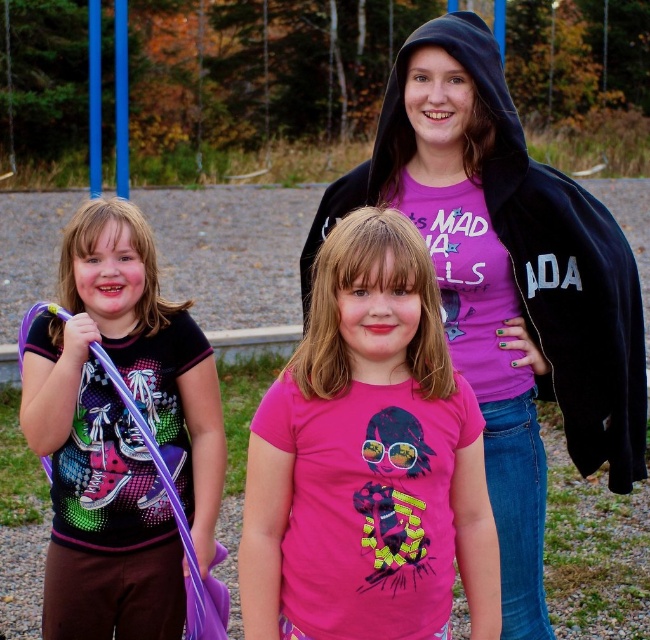
Question: Does matte black hoodie at upper center appear on the right side of matte purple wand at left?

Choices:
 (A) no
 (B) yes

Answer: (B)

Question: Where is pink matte t-shirt at center located in relation to matte purple wand at left in the image?

Choices:
 (A) right
 (B) left

Answer: (A)

Question: Does matte black hoodie at upper center have a lesser width compared to pink matte t-shirt at center?

Choices:
 (A) no
 (B) yes

Answer: (A)

Question: Which of the following is the farthest from the observer?

Choices:
 (A) pink matte t-shirt at center
 (B) matte purple wand at left
 (C) matte black hoodie at upper center

Answer: (C)

Question: Which of the following is the farthest from the observer?

Choices:
 (A) click(378, 232)
 (B) click(517, 490)
 (C) click(118, 481)

Answer: (B)

Question: Which point is closer to the camera?

Choices:
 (A) (528, 353)
 (B) (60, 397)
 (C) (489, 598)

Answer: (C)